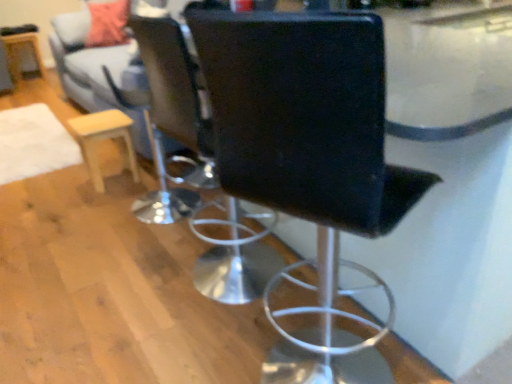
Question: From the image's perspective, relative to black leather chair at center, the 2th chair positioned from the front, is light wood/finely finished stool at left above or below?

Choices:
 (A) below
 (B) above

Answer: (B)

Question: In terms of width, does light wood/finely finished stool at left look wider or thinner when compared to black leather chair at center, the 2th chair positioned from the front?

Choices:
 (A) thin
 (B) wide

Answer: (A)

Question: Estimate the real-world distances between objects in this image. Which object is closer to the light gray fabric couch at upper left?

Choices:
 (A) wooden round table at left
 (B) black leather chair at center, arranged as the first chair when viewed from the back
 (C) light wood/finely finished stool at left
 (D) black leather chair at center, the 1th chair in the front-to-back sequence

Answer: (C)

Question: Which object is positioned farthest from the black leather chair at center, the 2th chair when ordered from back to front?

Choices:
 (A) black leather chair at center, arranged as the first chair when viewed from the back
 (B) light wood/finely finished stool at left
 (C) wooden round table at left
 (D) light gray fabric couch at upper left

Answer: (C)